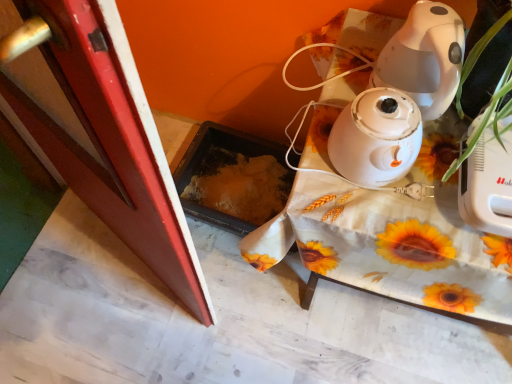
Find the location of a particular element. Image resolution: width=512 pixels, height=384 pixels. white glossy humidifier at center is located at coordinates (376, 137).

Where is `green leafy plant at right`? The width and height of the screenshot is (512, 384). green leafy plant at right is located at coordinates (489, 119).

How different are the orientations of green leafy plant at right and smooth red screen door at left in degrees?

They differ by 29.7 degrees in their facing directions.

Between green leafy plant at right and smooth red screen door at left, which one appears on the left side from the viewer's perspective?

Positioned to the left is smooth red screen door at left.

From a real-world perspective, is green leafy plant at right positioned under smooth red screen door at left based on gravity?

Incorrect, from a real-world perspective, green leafy plant at right is higher than smooth red screen door at left.

Where is `plant above the smooth red screen door at left (from a real-world perspective)`? The height and width of the screenshot is (384, 512). plant above the smooth red screen door at left (from a real-world perspective) is located at coordinates (489, 119).

Are white fabric-covered table at upper right and smooth red screen door at left located far from each other?

No, white fabric-covered table at upper right is not far away from smooth red screen door at left.

Does point (407, 227) come in front of point (184, 274)?

Yes, it is in front of point (184, 274).

Looking at this image, measure the distance from white fabric-covered table at upper right to smooth red screen door at left.

white fabric-covered table at upper right and smooth red screen door at left are 15.52 inches apart.

From the image's perspective, which one is positioned lower, white fabric-covered table at upper right or smooth red screen door at left?

From the image's view, white fabric-covered table at upper right is below.

Measure the distance between green leafy plant at right and white fabric-covered table at upper right.

8.10 inches.

In the scene shown: Is green leafy plant at right closer to camera compared to white fabric-covered table at upper right?

Yes, it is.

Would you say green leafy plant at right is inside or outside white fabric-covered table at upper right?

green leafy plant at right cannot be found inside white fabric-covered table at upper right.

Is smooth red screen door at left situated inside green leafy plant at right or outside?

smooth red screen door at left exists outside the volume of green leafy plant at right.

Does smooth red screen door at left lie behind green leafy plant at right?

Yes, smooth red screen door at left is further from the viewer.

Which is farther, (164, 248) or (442, 177)?

The point (164, 248) is more distant.

Find the location of `plant lying above the smooth red screen door at left (from the image's perspective)`. plant lying above the smooth red screen door at left (from the image's perspective) is located at coordinates (489, 119).

Choose the correct answer: Is white glossy humidifier at center inside green leafy plant at right or outside it?

white glossy humidifier at center is located beyond the bounds of green leafy plant at right.

Can you confirm if white glossy humidifier at center is taller than green leafy plant at right?

Incorrect, the height of white glossy humidifier at center is not larger of that of green leafy plant at right.

What's the angular difference between white glossy humidifier at center and white fabric-covered table at upper right's facing directions?

There is a 0.00669-degree angle between the facing directions of white glossy humidifier at center and white fabric-covered table at upper right.

From the image's perspective, which one is positioned lower, white glossy humidifier at center or white fabric-covered table at upper right?

white fabric-covered table at upper right, from the image's perspective.

Is white glossy humidifier at center positioned behind white fabric-covered table at upper right?

Yes, it is.

Would you say white glossy humidifier at center is inside or outside white fabric-covered table at upper right?

white glossy humidifier at center is not inside white fabric-covered table at upper right, it's outside.

In terms of height, does white fabric-covered table at upper right look taller or shorter compared to green leafy plant at right?

Considering their sizes, white fabric-covered table at upper right has more height than green leafy plant at right.

From a real-world perspective, is white fabric-covered table at upper right positioned over green leafy plant at right based on gravity?

No.

Which is behind, white fabric-covered table at upper right or green leafy plant at right?

white fabric-covered table at upper right is further away from the camera.

Is point (370, 242) more distant than point (498, 119)?

Yes, it is.

Identify the location of screen door below the green leafy plant at right (from the image's perspective). This screenshot has width=512, height=384. (102, 133).

Find the location of a particular element. table behind the smooth red screen door at left is located at coordinates (388, 222).

Based on their spatial positions, is green leafy plant at right or white fabric-covered table at upper right closer to white glossy humidifier at center?

green leafy plant at right is positioned closer to the anchor white glossy humidifier at center.

Which object lies further to the anchor point smooth red screen door at left, white glossy humidifier at center or white fabric-covered table at upper right?

white glossy humidifier at center is positioned further to the anchor smooth red screen door at left.

When comparing their distances from green leafy plant at right, does white glossy humidifier at center or smooth red screen door at left seem closer?

white glossy humidifier at center is closer to green leafy plant at right.

Looking at this image, from the image, which object appears to be nearer to white glossy humidifier at center, white fabric-covered table at upper right or smooth red screen door at left?

Based on the image, white fabric-covered table at upper right appears to be nearer to white glossy humidifier at center.

Looking at the image, which one is located further to green leafy plant at right, smooth red screen door at left or white glossy humidifier at center?

smooth red screen door at left.

From the image, which object appears to be farther from white fabric-covered table at upper right, white glossy humidifier at center or smooth red screen door at left?

Based on the image, smooth red screen door at left appears to be further to white fabric-covered table at upper right.

From the image, which object appears to be farther from white glossy humidifier at center, smooth red screen door at left or green leafy plant at right?

smooth red screen door at left lies further to white glossy humidifier at center than the other object.

Which object lies nearer to the anchor point white fabric-covered table at upper right, green leafy plant at right or white glossy humidifier at center?

Based on the image, white glossy humidifier at center appears to be nearer to white fabric-covered table at upper right.

I want to click on plant situated between smooth red screen door at left and white fabric-covered table at upper right from left to right, so click(489, 119).

Locate an element on the screen. home appliance situated between smooth red screen door at left and green leafy plant at right from left to right is located at coordinates (376, 137).

This screenshot has width=512, height=384. In order to click on home appliance between smooth red screen door at left and white fabric-covered table at upper right in the horizontal direction in this screenshot , I will do `click(376, 137)`.

Where is `table between green leafy plant at right and white glossy humidifier at center in the front-back direction`? table between green leafy plant at right and white glossy humidifier at center in the front-back direction is located at coordinates (388, 222).